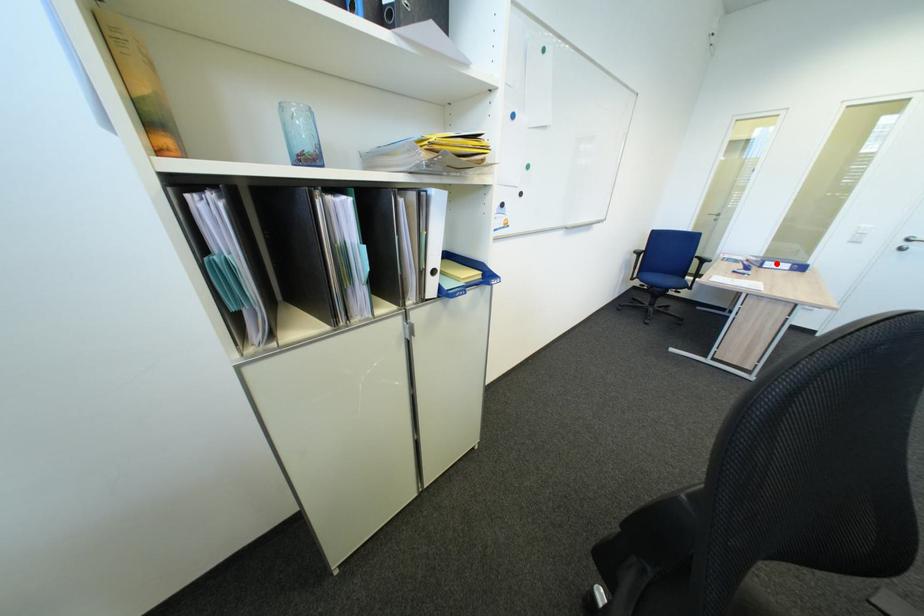
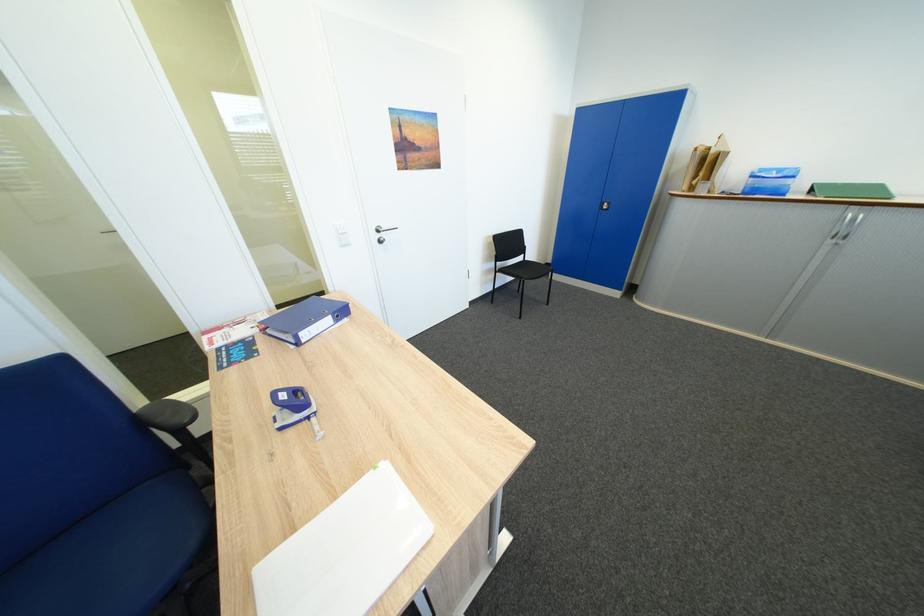
Question: I am providing you with two images of the same scene from different viewpoints. In image1, a red point is highlighted. Considering the same 3D point in image2, which of the following is correct?

Choices:
 (A) It is closer
 (B) It is farther

Answer: (A)